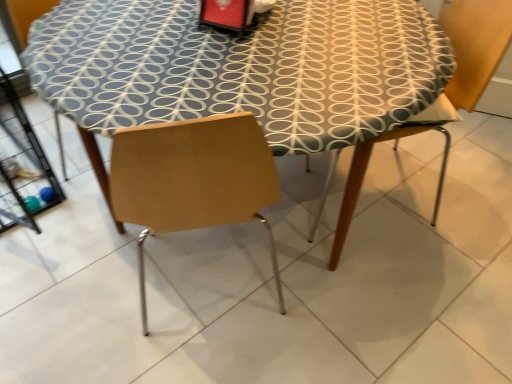
Question: Does point (465, 23) appear closer or farther from the camera than point (174, 89)?

Choices:
 (A) farther
 (B) closer

Answer: (A)

Question: Considering the relative positions of wooden chair at right and patterned fabric table at center in the image provided, is wooden chair at right to the left or to the right of patterned fabric table at center?

Choices:
 (A) left
 (B) right

Answer: (B)

Question: Relative to patterned fabric table at center, is wooden chair at right in front or behind?

Choices:
 (A) front
 (B) behind

Answer: (B)

Question: Is patterned fabric table at center in front of or behind wooden chair at right in the image?

Choices:
 (A) front
 (B) behind

Answer: (A)

Question: From a real-world perspective, is patterned fabric table at center above or below wooden chair at right?

Choices:
 (A) above
 (B) below

Answer: (B)

Question: Is patterned fabric table at center to the left or to the right of wooden chair at right in the image?

Choices:
 (A) right
 (B) left

Answer: (B)

Question: From the image's perspective, is patterned fabric table at center above or below wooden chair at right?

Choices:
 (A) below
 (B) above

Answer: (A)